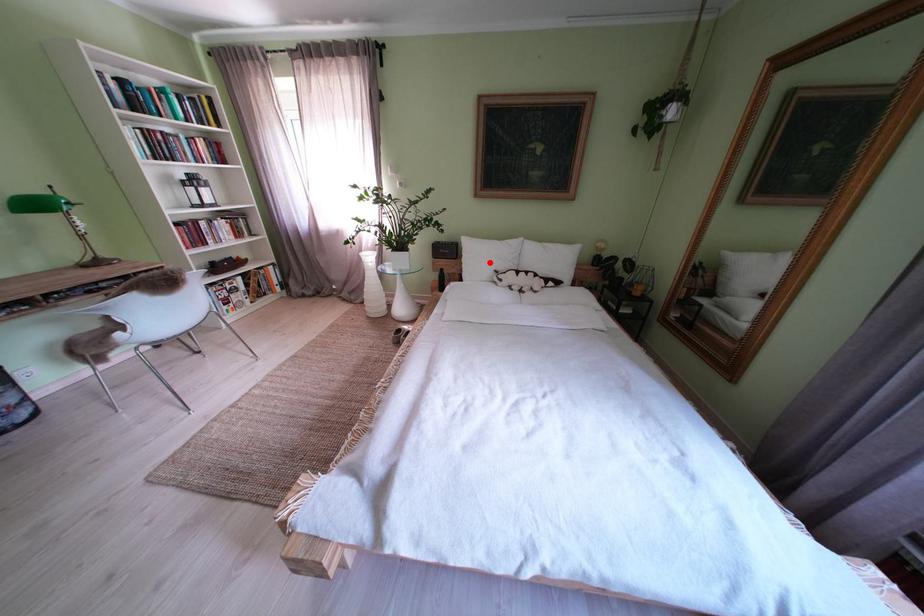
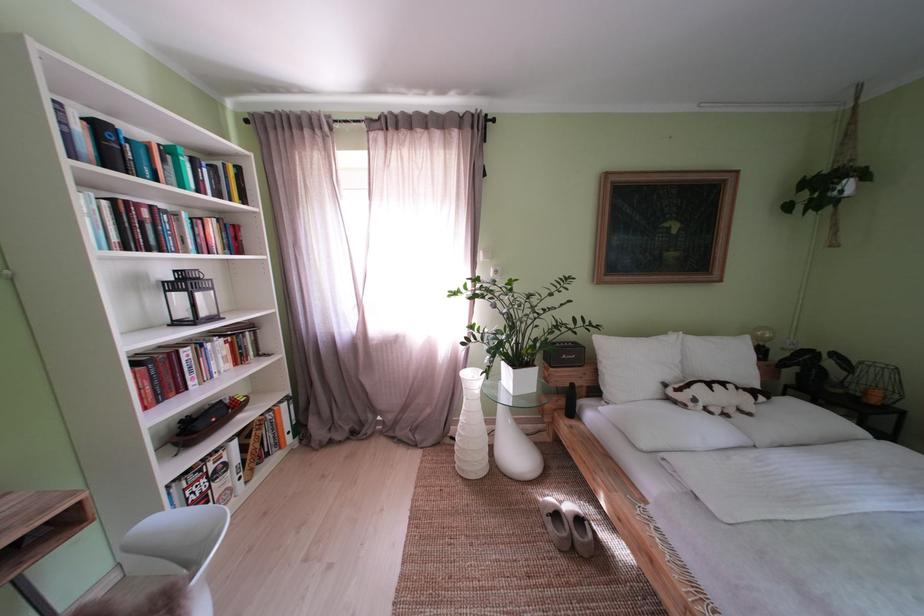
In the second image, find the point that corresponds to the highlighted location in the first image.

(639, 369)